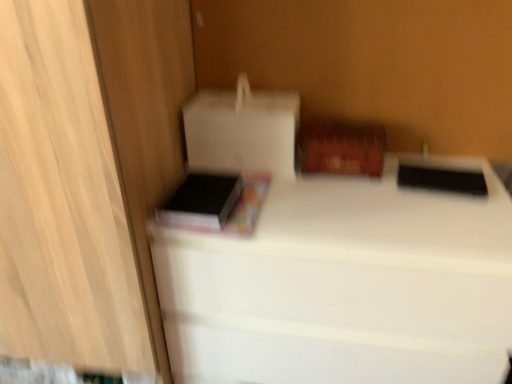
Locate an element on the screen. free spot in front of white matte cardboard box at upper left, marked as the 2th cardboard box in a right-to-left arrangement is located at coordinates (280, 200).